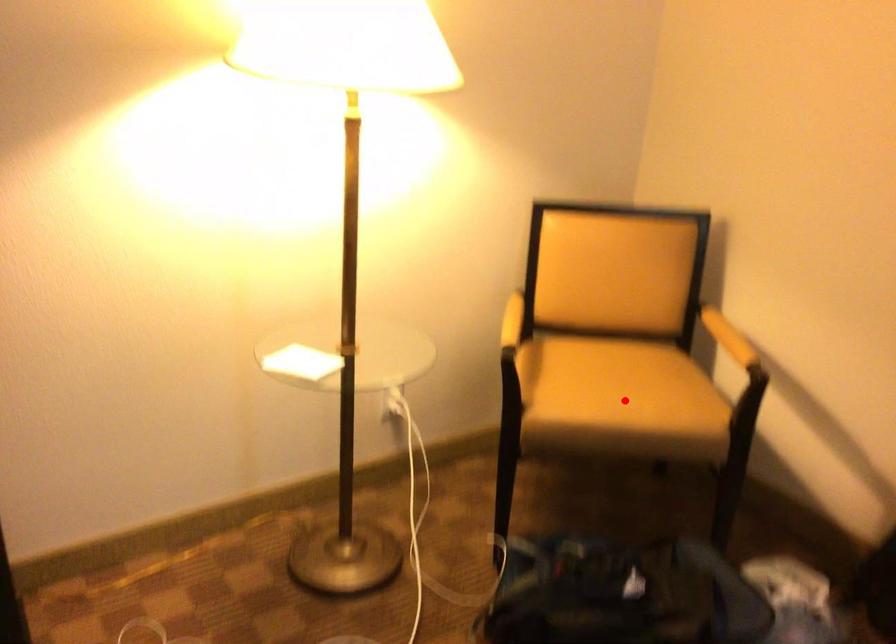
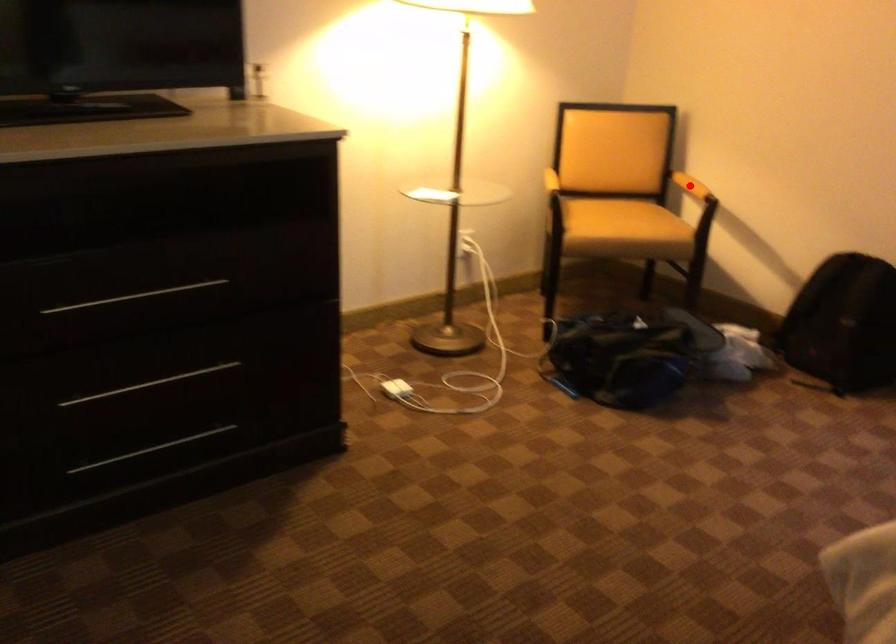
I am providing you with two images of the same scene from different viewpoints. A red point is marked on the first image and another point is marked on the second image. Are the points marked in image1 and image2 representing the same 3D position?

No